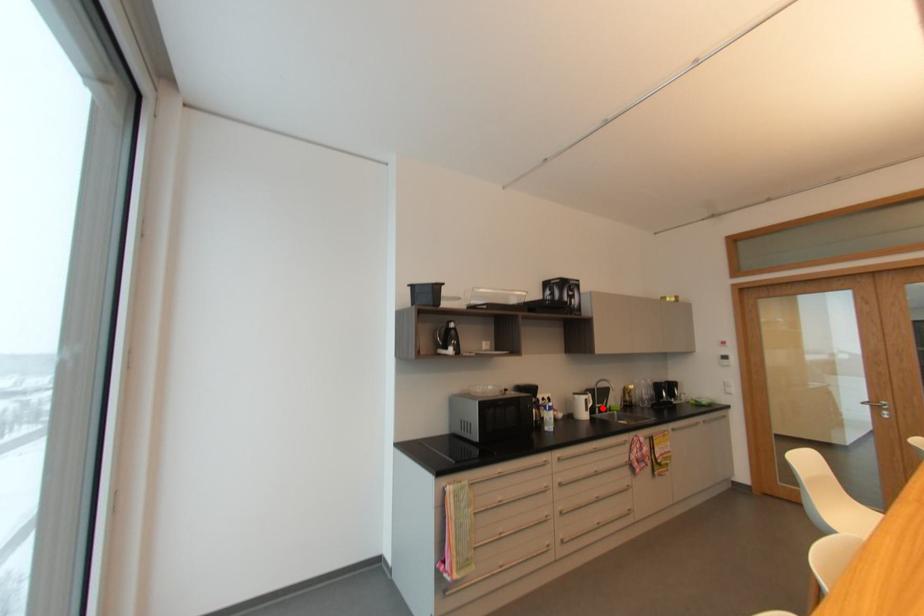
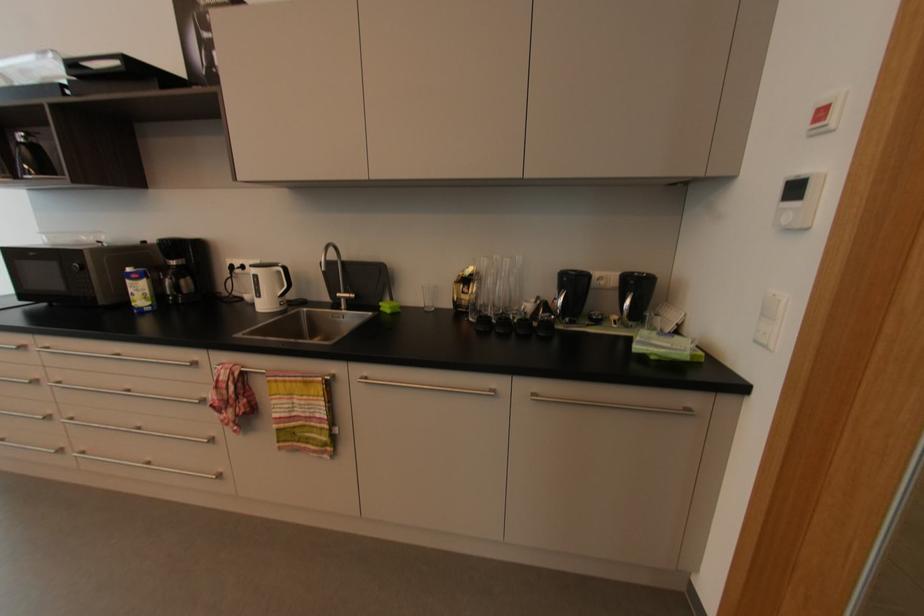
Locate, in the second image, the point that corresponds to the highlighted location in the first image.

(350, 300)